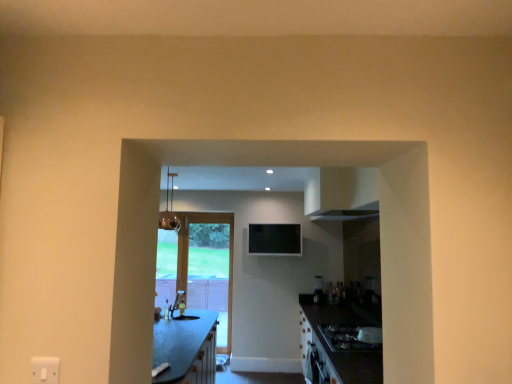
Question: Is wooden glass door at center to the left or to the right of matte white sink at center in the image?

Choices:
 (A) right
 (B) left

Answer: (A)

Question: Relative to matte white sink at center, is wooden glass door at center in front or behind?

Choices:
 (A) front
 (B) behind

Answer: (B)

Question: Estimate the real-world distances between objects in this image. Which object is closer to the black glossy gas stove at lower right?

Choices:
 (A) matte glass light fixture at upper center
 (B) matte white sink at center
 (C) wooden glass door at center
 (D) satin black blender at center

Answer: (D)

Question: Estimate the real-world distances between objects in this image. Which object is farther from the matte glass light fixture at upper center?

Choices:
 (A) black glossy gas stove at lower right
 (B) wooden glass door at center
 (C) satin black blender at center
 (D) matte white sink at center

Answer: (A)